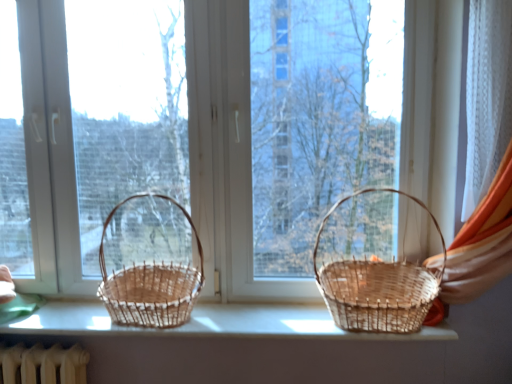
Question: Is woven natural basket at right, placed as the 1th picnic basket when sorted from right to left, bigger than woven wood baskets at center?

Choices:
 (A) no
 (B) yes

Answer: (B)

Question: Is woven natural basket at right, the second picnic basket viewed from the left, not inside woven wood baskets at center?

Choices:
 (A) yes
 (B) no

Answer: (A)

Question: Is woven wood baskets at center a part of woven natural basket at right, placed as the 1th picnic basket when sorted from right to left?

Choices:
 (A) no
 (B) yes

Answer: (A)

Question: Is woven natural basket at right, placed as the 1th picnic basket when sorted from right to left, far from woven wood baskets at center?

Choices:
 (A) yes
 (B) no

Answer: (B)

Question: Does woven natural basket at right, the second picnic basket viewed from the left, have a smaller size compared to woven wood baskets at center?

Choices:
 (A) yes
 (B) no

Answer: (B)

Question: Is point (394, 309) positioned closer to the camera than point (230, 327)?

Choices:
 (A) farther
 (B) closer

Answer: (B)

Question: Would you say woven natural basket at right, placed as the 1th picnic basket when sorted from right to left, is to the left or to the right of woven wood baskets at center in the picture?

Choices:
 (A) right
 (B) left

Answer: (A)

Question: From the image's perspective, relative to woven wood baskets at center, is woven natural basket at right, the second picnic basket viewed from the left, above or below?

Choices:
 (A) below
 (B) above

Answer: (B)

Question: In terms of width, does woven natural basket at right, the second picnic basket viewed from the left, look wider or thinner when compared to woven wood baskets at center?

Choices:
 (A) thin
 (B) wide

Answer: (B)

Question: Does point [x=143, y=321] appear closer or farther from the camera than point [x=422, y=168]?

Choices:
 (A) closer
 (B) farther

Answer: (A)

Question: From a real-world perspective, relative to natural wood baskets at center, is woven brown picnic basket at left, which ranks as the 1th picnic basket in left-to-right order, vertically above or below?

Choices:
 (A) below
 (B) above

Answer: (A)

Question: Considering their positions, is woven brown picnic basket at left, which ranks as the 1th picnic basket in left-to-right order, located in front of or behind natural wood baskets at center?

Choices:
 (A) front
 (B) behind

Answer: (A)

Question: In terms of height, does woven brown picnic basket at left, which ranks as the 2th picnic basket in right-to-left order, look taller or shorter compared to natural wood baskets at center?

Choices:
 (A) short
 (B) tall

Answer: (A)

Question: Visually, is woven wood baskets at center positioned to the left or to the right of natural wood baskets at center?

Choices:
 (A) left
 (B) right

Answer: (B)

Question: Is woven wood baskets at center bigger or smaller than natural wood baskets at center?

Choices:
 (A) big
 (B) small

Answer: (B)